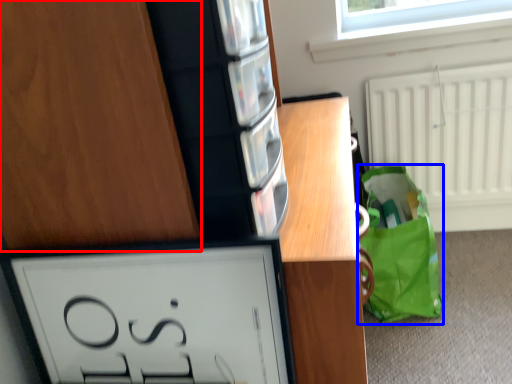
Question: Which object appears closest to the camera in this image, cabinetry (highlighted by a red box) or tote bag (highlighted by a blue box)?

Choices:
 (A) cabinetry
 (B) tote bag

Answer: (A)